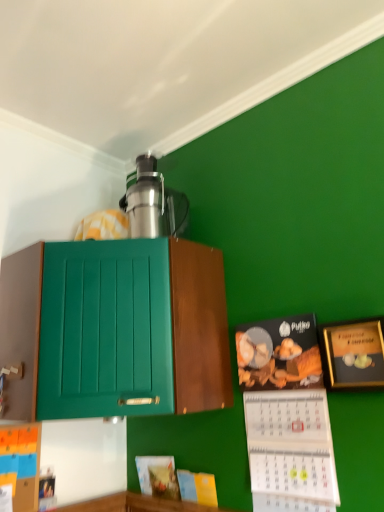
Question: Is matte black calendar at lower right, which ranks as the 1th book in right-to-left order, looking in the opposite direction of matte yellow book at lower center, the 2th book when ordered from right to left?

Choices:
 (A) yes
 (B) no

Answer: (B)

Question: Considering the relative sizes of matte black calendar at lower right, which ranks as the 1th book in right-to-left order, and matte yellow book at lower center, the 3th book viewed from the left, in the image provided, is matte black calendar at lower right, which ranks as the 1th book in right-to-left order, taller than matte yellow book at lower center, the 3th book viewed from the left,?

Choices:
 (A) yes
 (B) no

Answer: (A)

Question: Is matte black calendar at lower right, which is the fourth book in left-to-right order, wider than matte yellow book at lower center, the 3th book viewed from the left?

Choices:
 (A) yes
 (B) no

Answer: (A)

Question: Is the depth of matte black calendar at lower right, which ranks as the 1th book in right-to-left order, less than that of matte yellow book at lower center, the 2th book when ordered from right to left?

Choices:
 (A) yes
 (B) no

Answer: (A)

Question: Considering the relative sizes of matte black calendar at lower right, which is the fourth book in left-to-right order, and matte yellow book at lower center, the 3th book viewed from the left, in the image provided, is matte black calendar at lower right, which is the fourth book in left-to-right order, shorter than matte yellow book at lower center, the 3th book viewed from the left,?

Choices:
 (A) no
 (B) yes

Answer: (A)

Question: Considering the relative sizes of matte black calendar at lower right, which ranks as the 1th book in right-to-left order, and matte yellow book at lower center, the 3th book viewed from the left, in the image provided, is matte black calendar at lower right, which ranks as the 1th book in right-to-left order, smaller than matte yellow book at lower center, the 3th book viewed from the left,?

Choices:
 (A) yes
 (B) no

Answer: (B)

Question: Is green matte cabinet at upper left positioned in front of gold-framed picture at upper right?

Choices:
 (A) yes
 (B) no

Answer: (A)

Question: Can you confirm if green matte cabinet at upper left is thinner than gold-framed picture at upper right?

Choices:
 (A) yes
 (B) no

Answer: (B)

Question: From the image's perspective, is green matte cabinet at upper left over gold-framed picture at upper right?

Choices:
 (A) yes
 (B) no

Answer: (A)

Question: From a real-world perspective, does green matte cabinet at upper left sit lower than gold-framed picture at upper right?

Choices:
 (A) yes
 (B) no

Answer: (B)

Question: From the image's perspective, would you say green matte cabinet at upper left is shown under gold-framed picture at upper right?

Choices:
 (A) yes
 (B) no

Answer: (B)

Question: Considering the relative positions of green matte cabinet at upper left and gold-framed picture at upper right in the image provided, is green matte cabinet at upper left to the left of gold-framed picture at upper right from the viewer's perspective?

Choices:
 (A) yes
 (B) no

Answer: (A)

Question: Is the surface of satin silver thermos at upper center in direct contact with green matte cabinet at upper left?

Choices:
 (A) no
 (B) yes

Answer: (A)